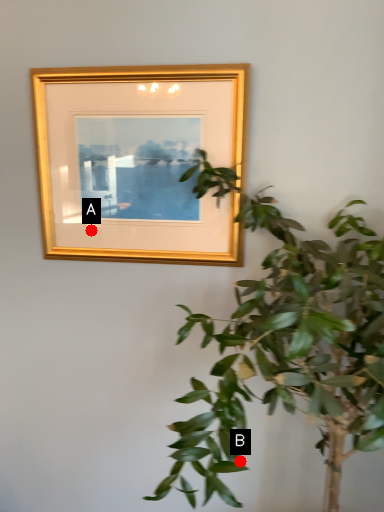
Question: Two points are circled on the image, labeled by A and B beside each circle. Among these points, which one is nearest to the camera?

Choices:
 (A) A is closer
 (B) B is closer

Answer: (A)